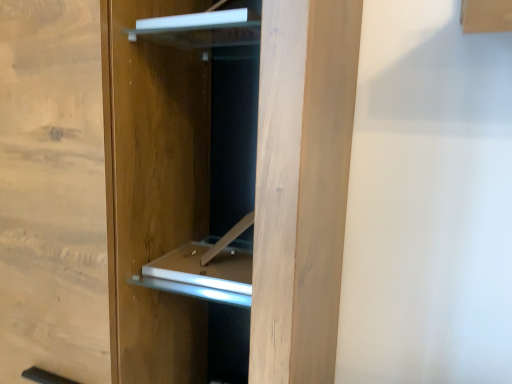
Question: From the image's perspective, is white glossy shelf at upper center located beneath natural wood door at center?

Choices:
 (A) yes
 (B) no

Answer: (B)

Question: Considering the relative sizes of white glossy shelf at upper center and natural wood door at center in the image provided, is white glossy shelf at upper center bigger than natural wood door at center?

Choices:
 (A) no
 (B) yes

Answer: (A)

Question: From a real-world perspective, is white glossy shelf at upper center below natural wood door at center?

Choices:
 (A) no
 (B) yes

Answer: (A)

Question: Is white glossy shelf at upper center positioned before natural wood door at center?

Choices:
 (A) yes
 (B) no

Answer: (B)

Question: Does white glossy shelf at upper center have a greater height compared to natural wood door at center?

Choices:
 (A) no
 (B) yes

Answer: (A)

Question: Is white glossy shelf at upper center shorter than natural wood door at center?

Choices:
 (A) yes
 (B) no

Answer: (A)

Question: From the image's perspective, is natural wood door at center above white glossy shelf at upper center?

Choices:
 (A) yes
 (B) no

Answer: (B)

Question: From the image's perspective, is natural wood door at center located beneath white glossy shelf at upper center?

Choices:
 (A) yes
 (B) no

Answer: (A)

Question: Does natural wood door at center touch white glossy shelf at upper center?

Choices:
 (A) no
 (B) yes

Answer: (A)

Question: Does natural wood door at center have a larger size compared to white glossy shelf at upper center?

Choices:
 (A) no
 (B) yes

Answer: (B)

Question: Is natural wood door at center positioned in front of white glossy shelf at upper center?

Choices:
 (A) no
 (B) yes

Answer: (B)

Question: Considering the relative sizes of natural wood door at center and white glossy shelf at upper center in the image provided, is natural wood door at center thinner than white glossy shelf at upper center?

Choices:
 (A) no
 (B) yes

Answer: (A)

Question: Is white glossy shelf at upper center spatially inside natural wood door at center, or outside of it?

Choices:
 (A) inside
 (B) outside

Answer: (A)